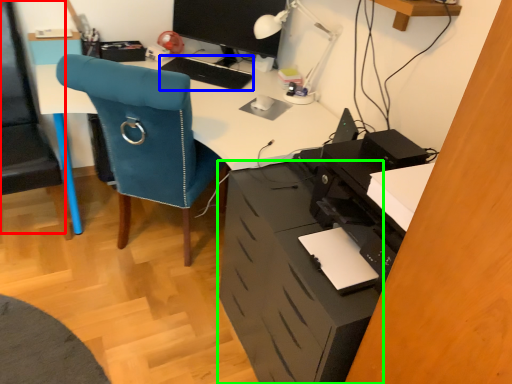
Question: Based on their relative distances, which object is nearer to computer chair (highlighted by a red box)? Choose from keyboard (highlighted by a blue box) and file cabinet (highlighted by a green box).

Choices:
 (A) keyboard
 (B) file cabinet

Answer: (A)